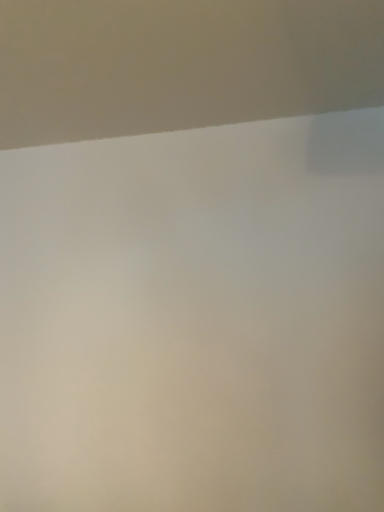
This screenshot has height=512, width=384. Identify the location of matte white wall at upper center. (180, 64).

What do you see at coordinates (180, 64) in the screenshot? I see `matte white wall at upper center` at bounding box center [180, 64].

In order to click on matte white wall at upper center in this screenshot , I will do `click(180, 64)`.